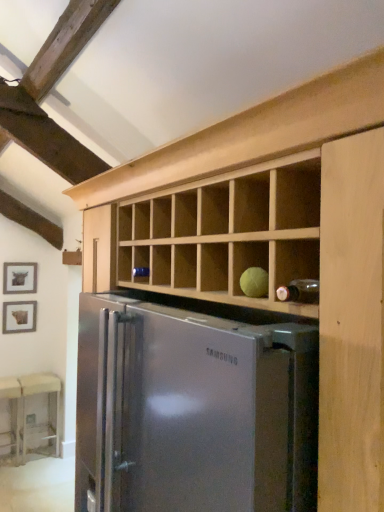
Question: Is the position of stainless steel refrigerator at center more distant than that of matte brown picture frame at left, positioned as the 2th picture frame in top-to-bottom order?

Choices:
 (A) yes
 (B) no

Answer: (B)

Question: Does stainless steel refrigerator at center have a smaller size compared to matte brown picture frame at left, positioned as the 2th picture frame in top-to-bottom order?

Choices:
 (A) no
 (B) yes

Answer: (A)

Question: Can you confirm if stainless steel refrigerator at center is shorter than matte brown picture frame at left, which is the 1th picture frame from bottom to top?

Choices:
 (A) no
 (B) yes

Answer: (A)

Question: Is matte brown picture frame at left, positioned as the 2th picture frame in top-to-bottom order, at the back of stainless steel refrigerator at center?

Choices:
 (A) yes
 (B) no

Answer: (B)

Question: Considering the relative sizes of stainless steel refrigerator at center and matte brown picture frame at left, positioned as the 2th picture frame in top-to-bottom order, in the image provided, is stainless steel refrigerator at center taller than matte brown picture frame at left, positioned as the 2th picture frame in top-to-bottom order,?

Choices:
 (A) yes
 (B) no

Answer: (A)

Question: From a real-world perspective, relative to matte black picture frame at left, arranged as the 1th picture frame when viewed from the top, is beige fabric table at lower left, positioned as the 2th table in left-to-right order, vertically above or below?

Choices:
 (A) below
 (B) above

Answer: (A)

Question: Based on their sizes in the image, would you say beige fabric table at lower left, which appears as the 1th table when viewed from the right, is bigger or smaller than matte black picture frame at left, the 2th picture frame in the bottom-to-top sequence?

Choices:
 (A) small
 (B) big

Answer: (B)

Question: In terms of height, does beige fabric table at lower left, positioned as the 2th table in left-to-right order, look taller or shorter compared to matte black picture frame at left, arranged as the 1th picture frame when viewed from the top?

Choices:
 (A) tall
 (B) short

Answer: (A)

Question: In terms of width, does beige fabric table at lower left, positioned as the 2th table in left-to-right order, look wider or thinner when compared to matte black picture frame at left, arranged as the 1th picture frame when viewed from the top?

Choices:
 (A) wide
 (B) thin

Answer: (A)

Question: From a real-world perspective, is wooden table at lower left, positioned as the 2th table in right-to-left order, positioned above or below matte brown picture frame at left, which is the 1th picture frame from bottom to top?

Choices:
 (A) above
 (B) below

Answer: (B)

Question: Looking at their shapes, would you say wooden table at lower left, the 1th table in the left-to-right sequence, is wider or thinner than matte brown picture frame at left, positioned as the 2th picture frame in top-to-bottom order?

Choices:
 (A) thin
 (B) wide

Answer: (B)

Question: Looking at the image, does wooden table at lower left, positioned as the 2th table in right-to-left order, seem bigger or smaller compared to matte brown picture frame at left, positioned as the 2th picture frame in top-to-bottom order?

Choices:
 (A) small
 (B) big

Answer: (B)

Question: Do you think wooden table at lower left, positioned as the 2th table in right-to-left order, is within matte brown picture frame at left, positioned as the 2th picture frame in top-to-bottom order, or outside of it?

Choices:
 (A) inside
 (B) outside

Answer: (B)

Question: Is beige fabric table at lower left, positioned as the 2th table in left-to-right order, inside or outside of matte brown picture frame at left, positioned as the 2th picture frame in top-to-bottom order?

Choices:
 (A) outside
 (B) inside

Answer: (A)

Question: In terms of height, does beige fabric table at lower left, positioned as the 2th table in left-to-right order, look taller or shorter compared to matte brown picture frame at left, positioned as the 2th picture frame in top-to-bottom order?

Choices:
 (A) short
 (B) tall

Answer: (B)